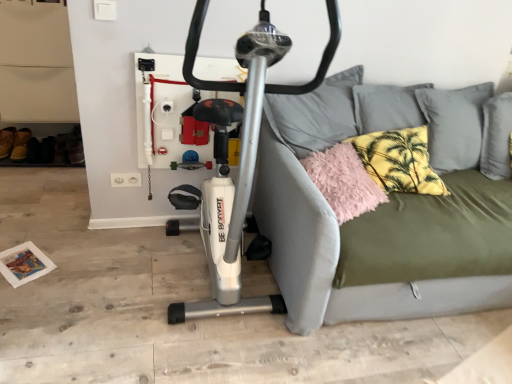
Identify the location of vacant space underneath silver metallic stationary bicycle at center (from a real-world perspective). This screenshot has height=384, width=512. (206, 286).